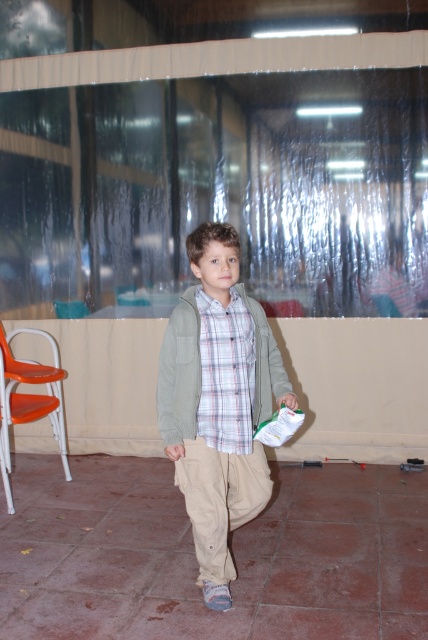
Between light brown cotton pants at center and orange plastic chair at lower left, which one is positioned lower?

Positioned lower is orange plastic chair at lower left.

Can you confirm if light brown cotton pants at center is taller than orange plastic chair at lower left?

Yes.

Which is in front, point (211, 435) or point (41, 376)?

Point (211, 435) is in front.

Identify the location of light brown cotton pants at center. The width and height of the screenshot is (428, 640). (219, 401).

Is plaid fabric shirt at center shorter than orange plastic chair at lower left?

Correct, plaid fabric shirt at center is not as tall as orange plastic chair at lower left.

Does plaid fabric shirt at center have a greater height compared to orange plastic chair at lower left?

No, plaid fabric shirt at center is not taller than orange plastic chair at lower left.

Does point (246, 317) lie in front of point (11, 396)?

Yes, point (246, 317) is in front of point (11, 396).

Where is `plaid fabric shirt at center`? This screenshot has height=640, width=428. plaid fabric shirt at center is located at coordinates (225, 372).

In the scene shown: Which is more to the right, light brown cotton pants at center or smooth beige hand at center?

light brown cotton pants at center is more to the right.

Does light brown cotton pants at center appear under smooth beige hand at center?

No, light brown cotton pants at center is not below smooth beige hand at center.

Between point (235, 403) and point (172, 449), which one is positioned in front?

Point (172, 449) is in front.

You are a GUI agent. You are given a task and a screenshot of the screen. Output one action in this format:
    pyautogui.click(x=<x>, y=<y>)
    Task: Click on the light brown cotton pants at center
    Image resolution: width=428 pixels, height=640 pixels.
    Given the screenshot: What is the action you would take?
    pyautogui.click(x=219, y=401)